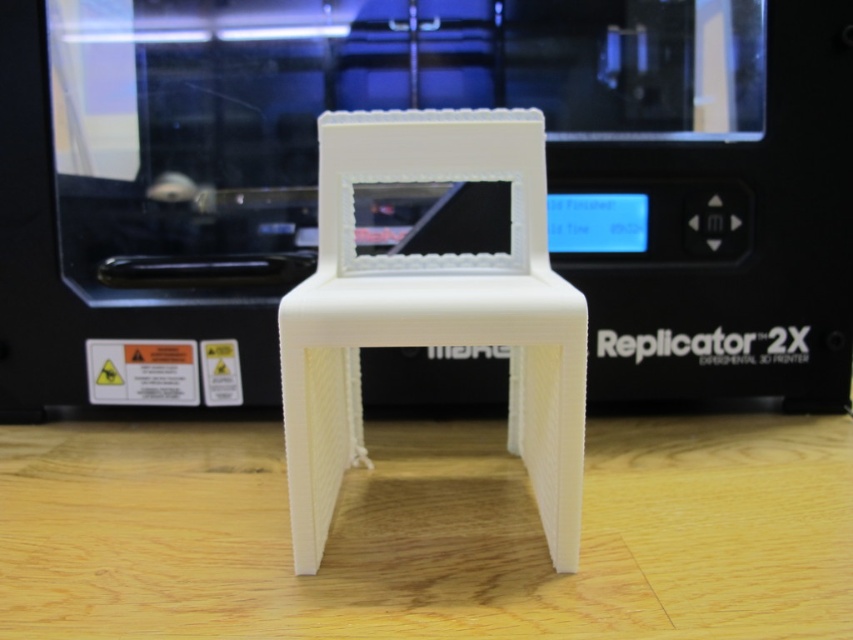
Can you confirm if white matte chair at center is smaller than white matte plastic chair at center?

No.

Who is higher up, white matte chair at center or white matte plastic chair at center?

white matte plastic chair at center is higher up.

Locate an element on the screen. This screenshot has height=640, width=853. white matte chair at center is located at coordinates (428, 532).